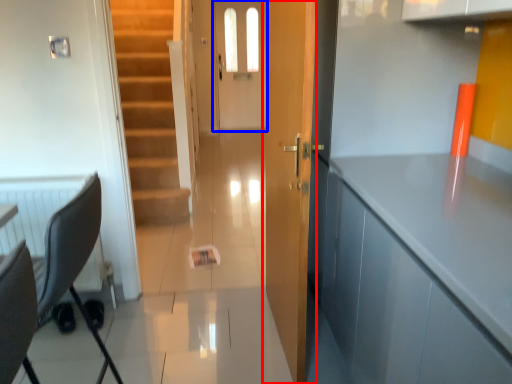
Question: Which object appears closest to the camera in this image, door (highlighted by a red box) or screen door (highlighted by a blue box)?

Choices:
 (A) door
 (B) screen door

Answer: (A)